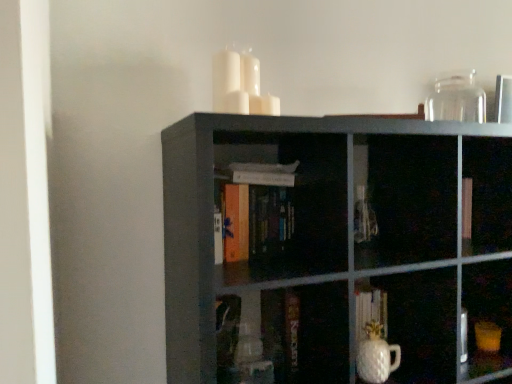
Question: Does matte black bookshelf at center have a lesser width compared to white glossy vase at lower center, the second glass vase from the top?

Choices:
 (A) no
 (B) yes

Answer: (A)

Question: Is matte black bookshelf at center not near white glossy vase at lower center, the second glass vase from the right?

Choices:
 (A) no
 (B) yes

Answer: (A)

Question: Is matte black bookshelf at center positioned behind white glossy vase at lower center, the first glass vase from the left?

Choices:
 (A) yes
 (B) no

Answer: (B)

Question: From the image's perspective, would you say matte black bookshelf at center is positioned over white glossy vase at lower center, the second glass vase from the top?

Choices:
 (A) no
 (B) yes

Answer: (B)

Question: From a real-world perspective, is matte black bookshelf at center over white glossy vase at lower center, the first glass vase from the left?

Choices:
 (A) no
 (B) yes

Answer: (B)

Question: Is orange matte book at center inside or outside of matte black bookshelf at center?

Choices:
 (A) inside
 (B) outside

Answer: (A)

Question: From their relative heights in the image, would you say orange matte book at center is taller or shorter than matte black bookshelf at center?

Choices:
 (A) short
 (B) tall

Answer: (A)

Question: Visually, is orange matte book at center positioned to the left or to the right of matte black bookshelf at center?

Choices:
 (A) left
 (B) right

Answer: (A)

Question: From the image's perspective, is orange matte book at center located above or below matte black bookshelf at center?

Choices:
 (A) below
 (B) above

Answer: (B)

Question: Is transparent glass jar at upper right, the second glass vase positioned from the left, bigger or smaller than matte black bookshelf at center?

Choices:
 (A) big
 (B) small

Answer: (B)

Question: Considering the positions of transparent glass jar at upper right, which appears as the first glass vase when viewed from the top, and matte black bookshelf at center in the image, is transparent glass jar at upper right, which appears as the first glass vase when viewed from the top, taller or shorter than matte black bookshelf at center?

Choices:
 (A) tall
 (B) short

Answer: (B)

Question: Relative to matte black bookshelf at center, is transparent glass jar at upper right, the 2th glass vase when ordered from front to back, in front or behind?

Choices:
 (A) behind
 (B) front

Answer: (A)

Question: Is transparent glass jar at upper right, the second glass vase positioned from the left, situated inside matte black bookshelf at center or outside?

Choices:
 (A) outside
 (B) inside

Answer: (A)

Question: Looking at their shapes, would you say transparent glass jar at upper right, marked as the 1th glass vase in a back-to-front arrangement, is wider or thinner than white glossy vase at lower center, the first glass vase in the bottom-to-top sequence?

Choices:
 (A) wide
 (B) thin

Answer: (A)

Question: Considering the positions of transparent glass jar at upper right, the first glass vase in the right-to-left sequence, and white glossy vase at lower center, the second glass vase from the right, in the image, is transparent glass jar at upper right, the first glass vase in the right-to-left sequence, taller or shorter than white glossy vase at lower center, the second glass vase from the right,?

Choices:
 (A) short
 (B) tall

Answer: (B)